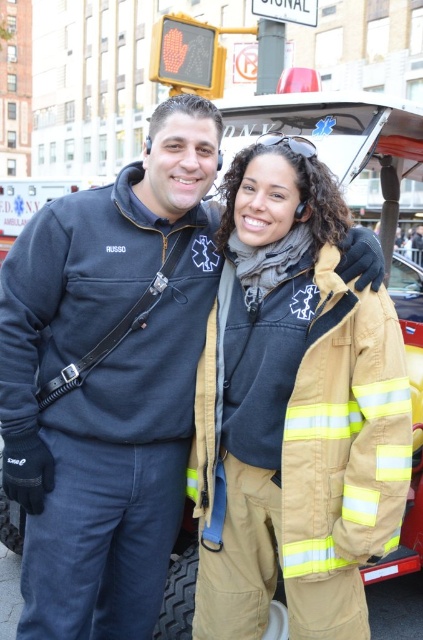
Is point (60, 612) farther from camera compared to point (351, 477)?

Yes, point (60, 612) is farther from viewer.

This screenshot has width=423, height=640. Describe the element at coordinates (107, 380) in the screenshot. I see `matte black jacket at center` at that location.

Locate an element on the screen. matte black jacket at center is located at coordinates (107, 380).